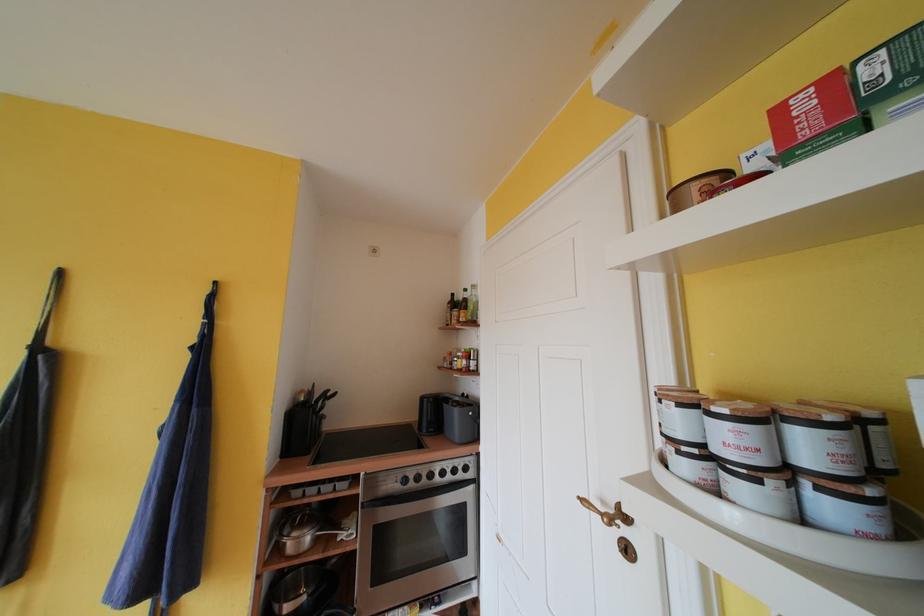
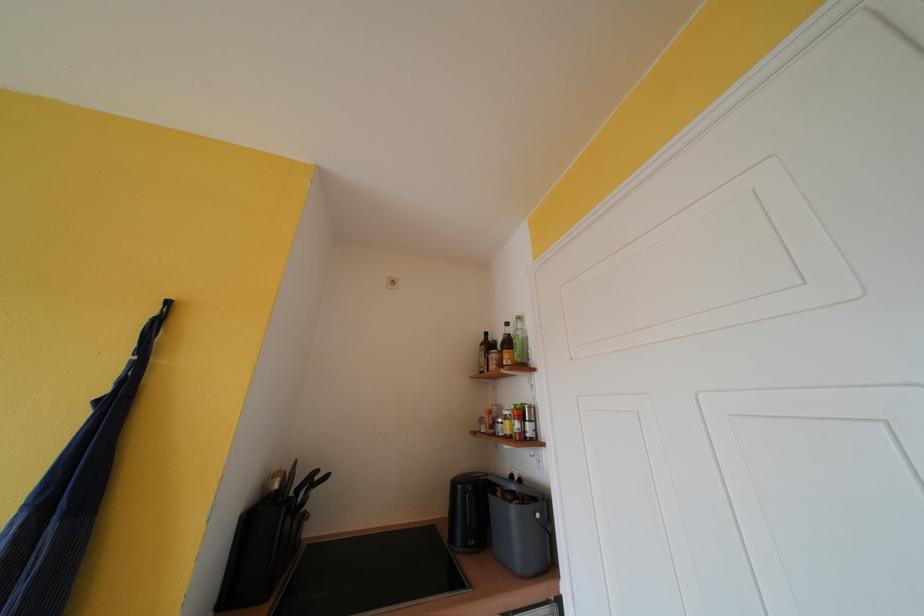
Question: The first image is from the beginning of the video and the second image is from the end. How did the camera likely rotate when shooting the video?

Choices:
 (A) Left
 (B) Right
 (C) Up
 (D) Down

Answer: (C)